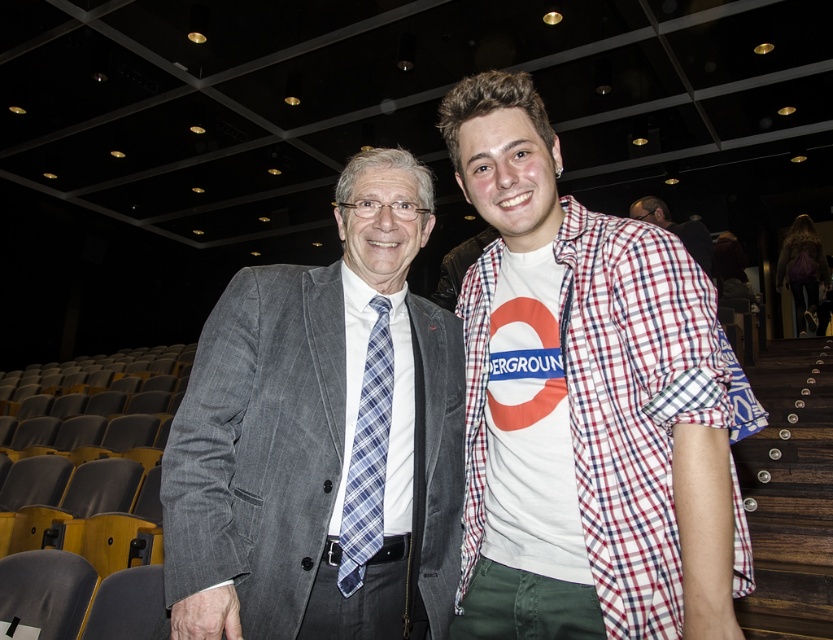
Is point (491, 449) in front of point (287, 529)?

No, it is behind (287, 529).

What do you see at coordinates (584, 404) in the screenshot?
I see `white cotton shirt at center` at bounding box center [584, 404].

Which is behind, point (677, 292) or point (340, 364)?

The point (340, 364) is behind.

Find the location of `white cotton shirt at center`. white cotton shirt at center is located at coordinates (584, 404).

Is blue plaid tie at center further to the viewer compared to red plaid shirt at center?

No, it is not.

Can you confirm if blue plaid tie at center is bigger than red plaid shirt at center?

Incorrect, blue plaid tie at center is not larger than red plaid shirt at center.

Between point (373, 458) and point (629, 212), which one is positioned behind?

Positioned behind is point (629, 212).

Where is `blue plaid tie at center`? blue plaid tie at center is located at coordinates (367, 458).

Between point (627, 419) and point (385, 298), which one is positioned behind?

Positioned behind is point (385, 298).

Is white cotton shirt at center thinner than blue plaid tie at center?

In fact, white cotton shirt at center might be wider than blue plaid tie at center.

Who is more forward, (682, 268) or (357, 541)?

Positioned in front is point (682, 268).

The height and width of the screenshot is (640, 833). I want to click on white cotton shirt at center, so click(x=584, y=404).